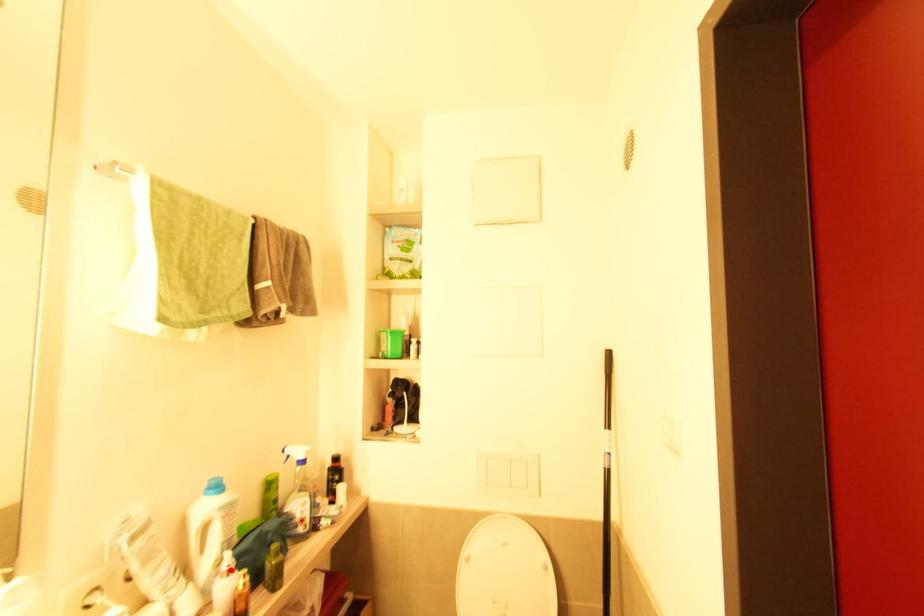
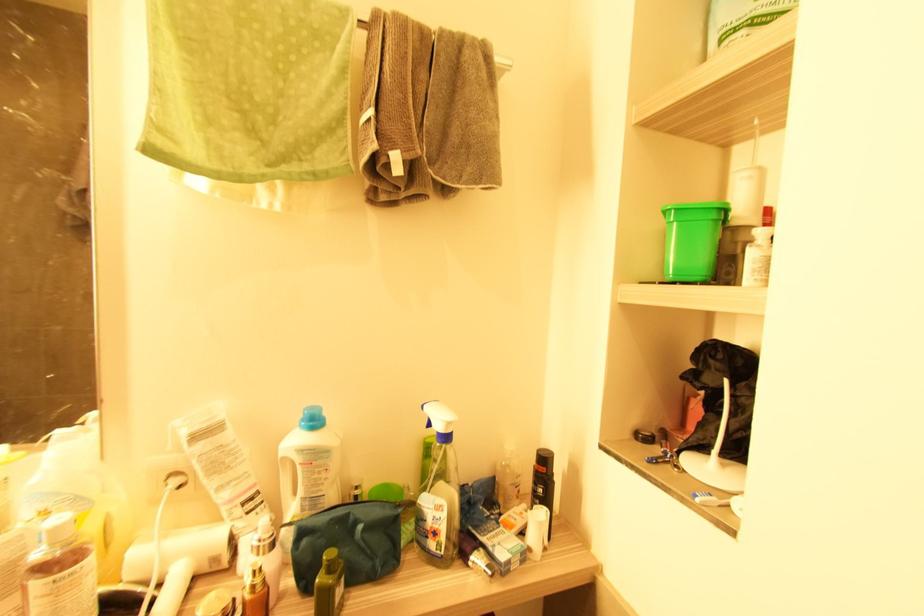
Locate, in the second image, the point that corresponds to the highlighted location in the first image.

(261, 546)